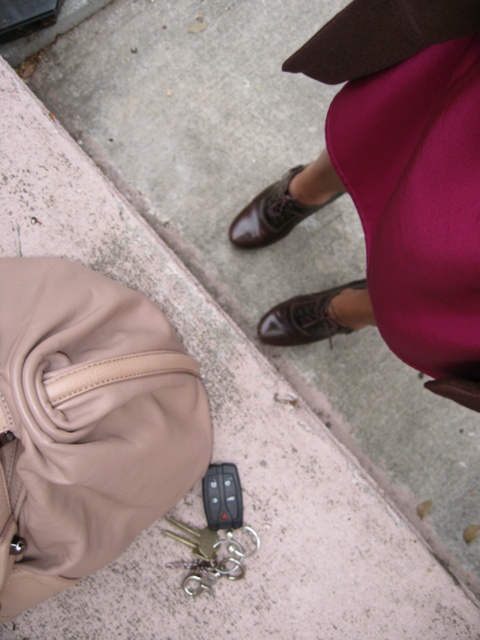
Question: Which point is closer to the camera?

Choices:
 (A) brown leather shoes at center
 (B) tan leather handbag at lower left
 (C) shiny brown shoe at center

Answer: (A)

Question: Is brown leather shoes at center positioned before shiny brown leather shoe at center?

Choices:
 (A) yes
 (B) no

Answer: (A)

Question: Which point is farther to the camera?

Choices:
 (A) (159, 372)
 (B) (313, 294)
 (C) (425, 36)
 (D) (271, 224)

Answer: (D)

Question: Which point appears closest to the camera in this image?

Choices:
 (A) (264, 330)
 (B) (460, 291)
 (C) (119, 456)
 (D) (301, 205)

Answer: (B)

Question: Is the position of shiny brown shoe at center more distant than that of shiny brown leather shoe at center?

Choices:
 (A) yes
 (B) no

Answer: (B)

Question: Is brown leather shoes at center above tan leather handbag at lower left?

Choices:
 (A) no
 (B) yes

Answer: (B)